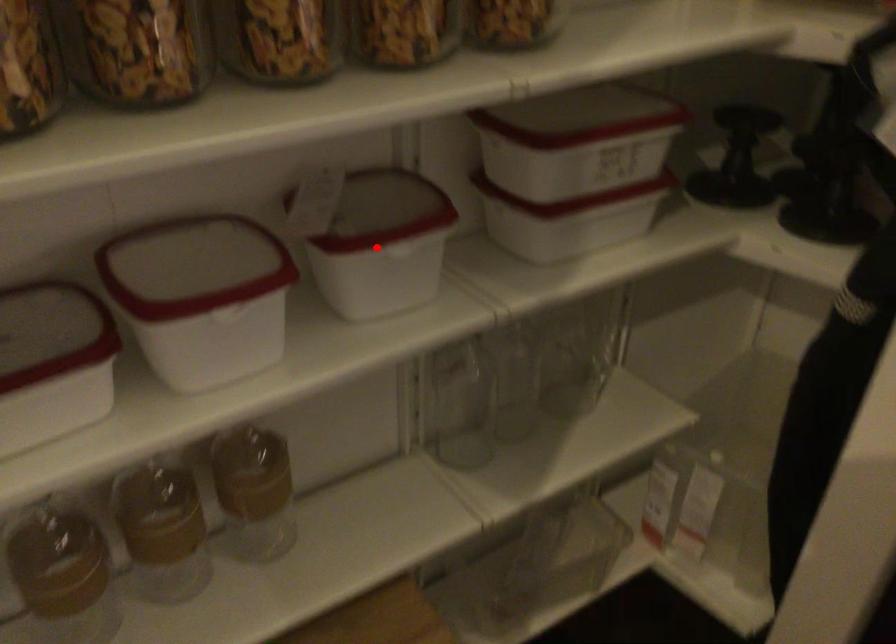
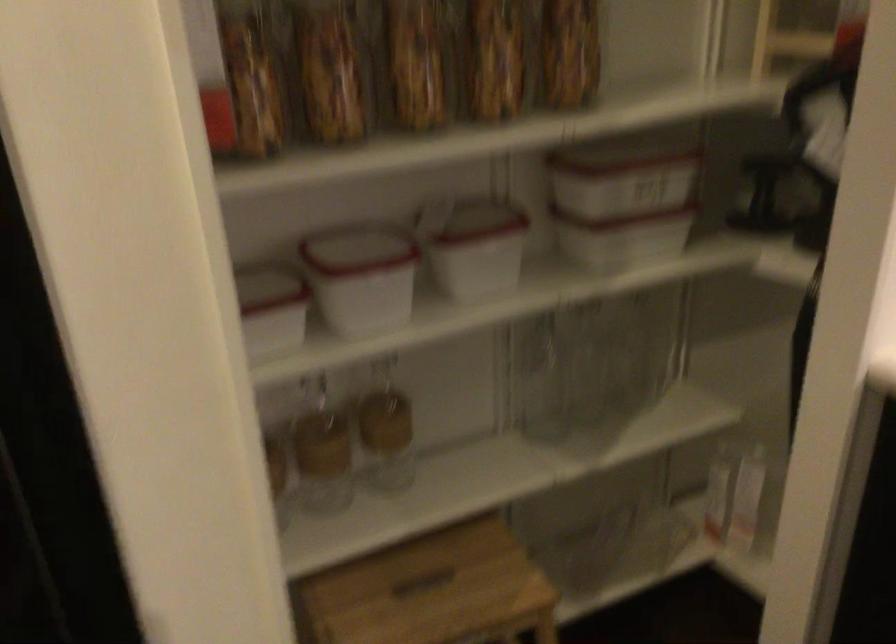
Question: A red point is marked in image1. In image2, is the corresponding 3D point closer to the camera or farther? Reply with the corresponding letter.

Choices:
 (A) The corresponding 3D point is closer.
 (B) The corresponding 3D point is farther.

Answer: (B)